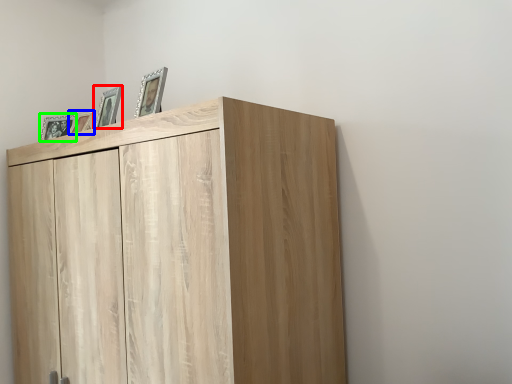
Question: Considering the real-world distances, which object is closest to picture frame (highlighted by a red box)? picture frame (highlighted by a blue box) or picture frame (highlighted by a green box).

Choices:
 (A) picture frame
 (B) picture frame

Answer: (A)